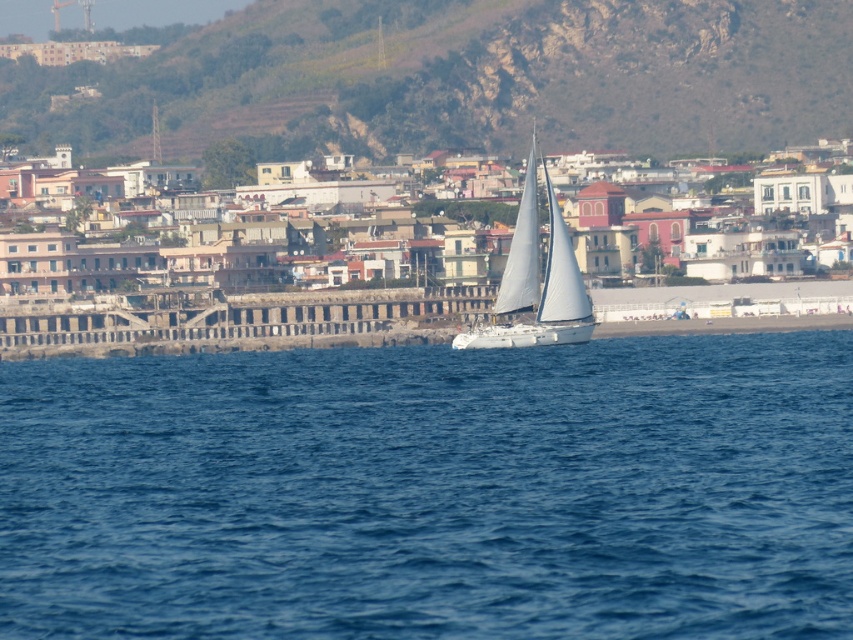
You are a photographer planning to capture the entire scene of the blue water at center and the white matte sailboat at center in one shot. Based on their sizes, which object should you focus on to ensure both are clearly visible in the frame?

The blue water at center has a larger width than the white matte sailboat at center, so focusing on the blue water at center will ensure both objects are clearly visible in the frame.

You are a marine biologist planning to measure the distance between the blue water at center and the white matte sailboat at center in the coastal scene. Given that your measuring tool has a maximum range of 150 feet, will it be sufficient to measure this distance?

The distance between the blue water at center and the white matte sailboat at center is 168.26 feet, which exceeds the measuring tool with a maximum range of 150 feet. Therefore, the tool is insufficient for this measurement.